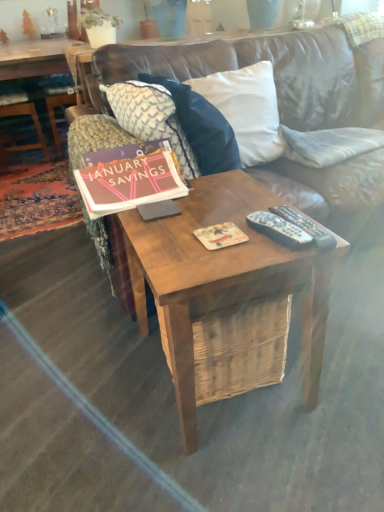
At what (x,y) coordinates should I click in order to perform the action: click on free region on the left part of black plastic remote controls at center, arranged as the 1th remote control when viewed from the right. Please return your answer as a coordinate pair (x, y). Image resolution: width=384 pixels, height=512 pixels. Looking at the image, I should click on (228, 239).